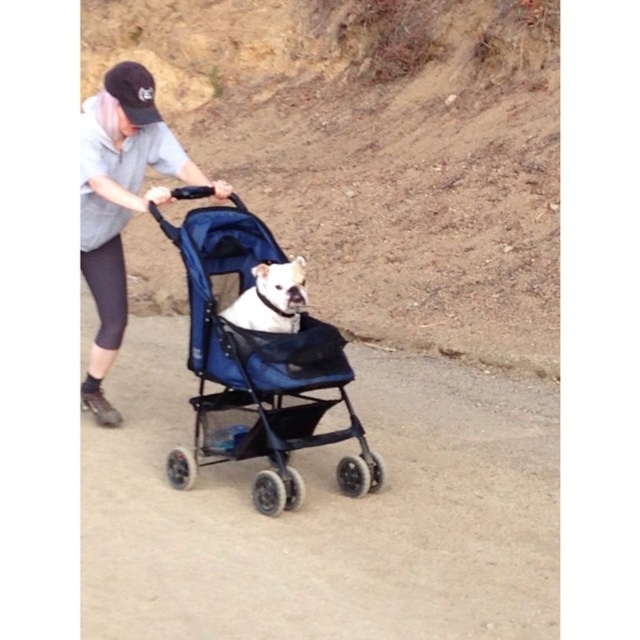
Does point (300, 284) come behind point (109, 88)?

No.

Identify the location of white matte dog at center. The height and width of the screenshot is (640, 640). (272, 298).

This screenshot has width=640, height=640. I want to click on white matte dog at center, so click(272, 298).

Can you confirm if blue fabric stroller at center is smaller than gray fabric shirt at upper left?

Yes, blue fabric stroller at center is smaller than gray fabric shirt at upper left.

Between point (216, 243) and point (99, 412), which one is positioned behind?

Point (99, 412)

This screenshot has height=640, width=640. I want to click on blue fabric stroller at center, so click(257, 369).

In the scene shown: Can you confirm if blue fabric stroller at center is wider than white matte dog at center?

Yes.

Who is more distant from viewer, (360, 467) or (300, 298)?

The point (360, 467) is more distant.

The width and height of the screenshot is (640, 640). I want to click on blue fabric stroller at center, so click(257, 369).